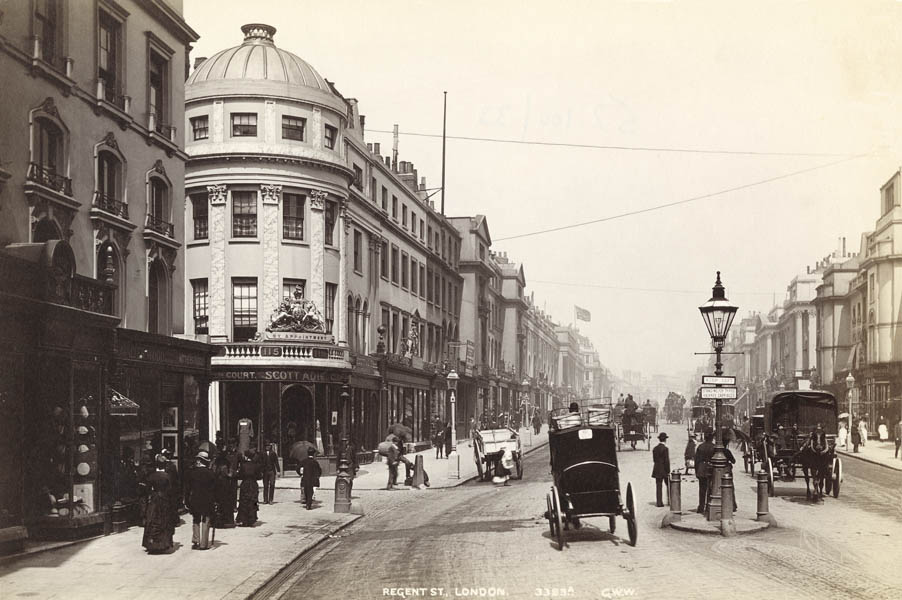
Image resolution: width=902 pixels, height=600 pixels. In order to click on bulb in this screenshot , I will do `click(714, 321)`.